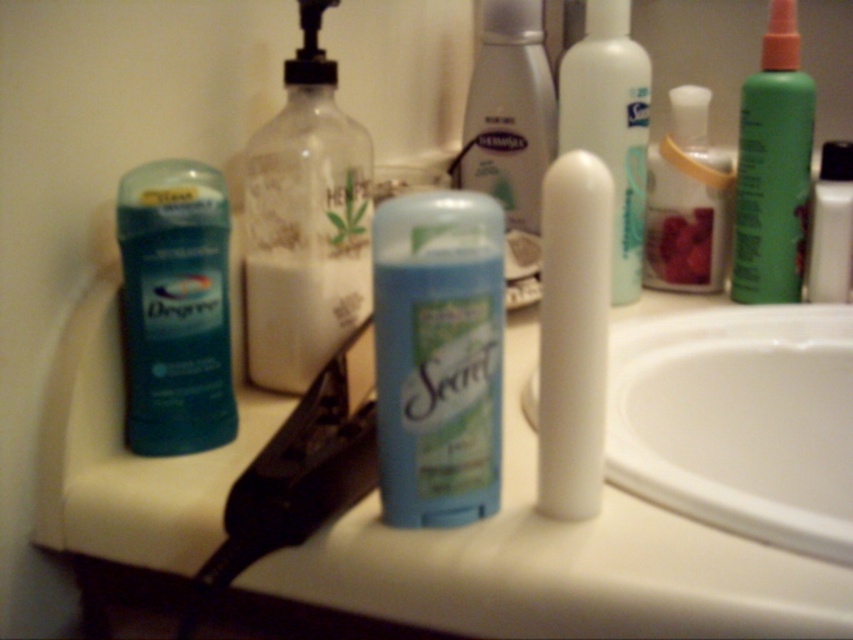
You are organizing a bathroom shelf and need to place the blue matte deodorant at center and the teal matte deodorant at left. According to their current positions on the countertop, which one should you place on the right side of the shelf to match their arrangement?

The blue matte deodorant at center should be placed on the right side of the shelf because it is currently positioned to the right of the teal matte deodorant at left.

You are organizing the bathroom countertop and want to stack the blue matte deodorant at center and the white glossy lotion at center vertically. Can you place the shorter one on top of the taller one without it falling over?

The blue matte deodorant at center is shorter than the white glossy lotion at center, so placing the shorter one on top of the taller one would be stable and prevent it from falling over.